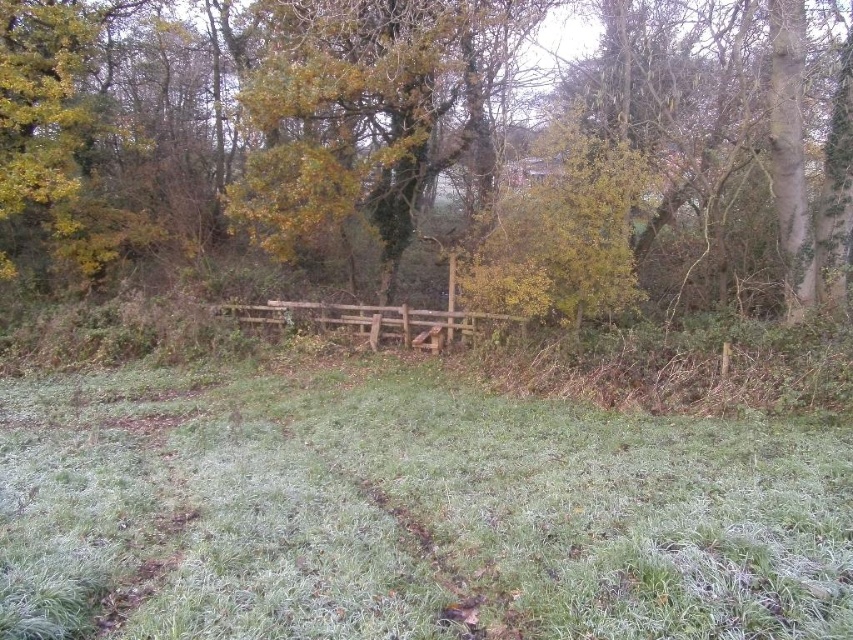
Question: Where is green grassy at center located in relation to green leafy tree at center in the image?

Choices:
 (A) below
 (B) above

Answer: (A)

Question: Which is farther from the green leafy tree at center?

Choices:
 (A) wooden fence at center
 (B) green grassy at center

Answer: (B)

Question: Which point appears farthest from the camera in this image?

Choices:
 (A) (451, 288)
 (B) (683, 497)

Answer: (A)

Question: Does green grassy at center have a smaller size compared to green leafy tree at center?

Choices:
 (A) yes
 (B) no

Answer: (A)

Question: Does green grassy at center appear on the right side of green leafy tree at center?

Choices:
 (A) no
 (B) yes

Answer: (B)

Question: Which object is closer to the camera taking this photo?

Choices:
 (A) green leafy tree at center
 (B) green grassy at center
 (C) wooden fence at center

Answer: (B)